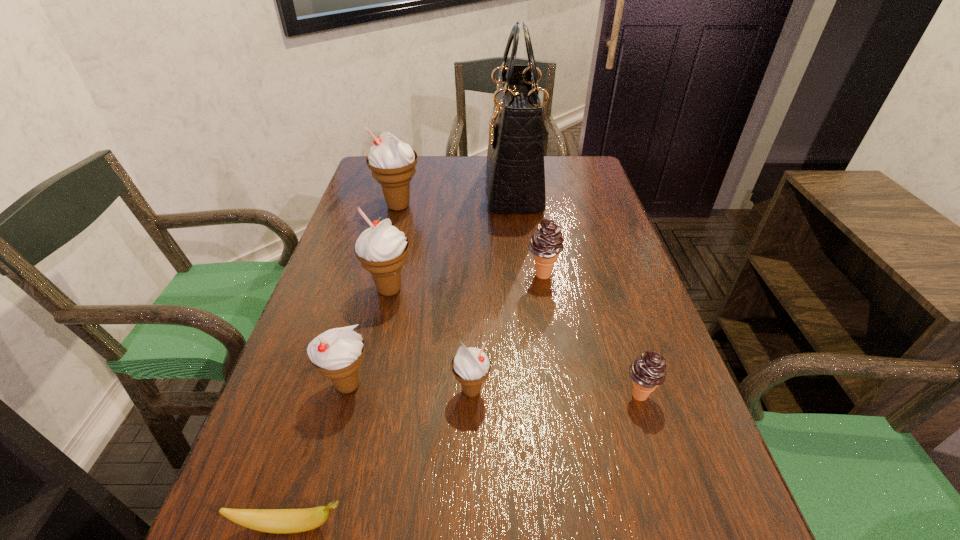
Identify the location of the rightmost object. (648, 371).

Identify the location of the rightmost icecream. (648, 371).

Where is `banana`? This screenshot has width=960, height=540. banana is located at coordinates 279,521.

I want to click on the shortest object, so click(x=279, y=521).

Locate an element on the screen. The image size is (960, 540). vacant space located at the front of the tallest object with visible charms is located at coordinates (364, 186).

You are a GUI agent. You are given a task and a screenshot of the screen. Output one action in this format:
    pyautogui.click(x=<x>, y=<y>)
    Task: Click on the free point located 0.310m at the front of the tallest object with visible charms
    
    Given the screenshot: What is the action you would take?
    pyautogui.click(x=389, y=186)

You are a GUI agent. You are given a task and a screenshot of the screen. Output one action in this format:
    pyautogui.click(x=<x>, y=<y>)
    Task: Click on the vacant area located 0.150m at the front of the tallest object with visible charms
    
    Given the screenshot: What is the action you would take?
    pyautogui.click(x=440, y=186)

At what (x,y) coordinates should I click in order to perform the action: click on free space located 0.130m on the back of the seventh shortest object. Please return your answer as a coordinate pair (x, y). Looking at the image, I should click on (407, 174).

Identify the location of vacant space located on the right of the sixth shortest object. point(586,289).

In order to click on vacant space located on the front of the left chocolate icecream in this screenshot , I will do `click(549, 313)`.